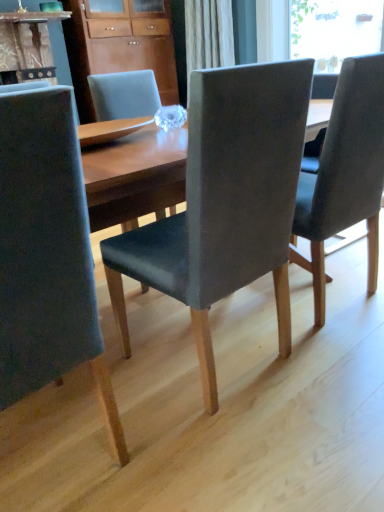
This screenshot has height=512, width=384. Find the location of `vacant space underneath matte gray chair at left, arranged as the 1th chair when viewed from the left (from a real-world perspective)`. vacant space underneath matte gray chair at left, arranged as the 1th chair when viewed from the left (from a real-world perspective) is located at coordinates (50, 453).